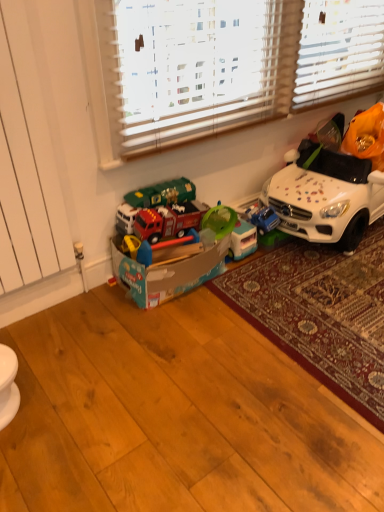
Find the location of a particular element. free space in front of green plastic cup at center, arranged as the 2th toy when viewed from the left is located at coordinates (241, 270).